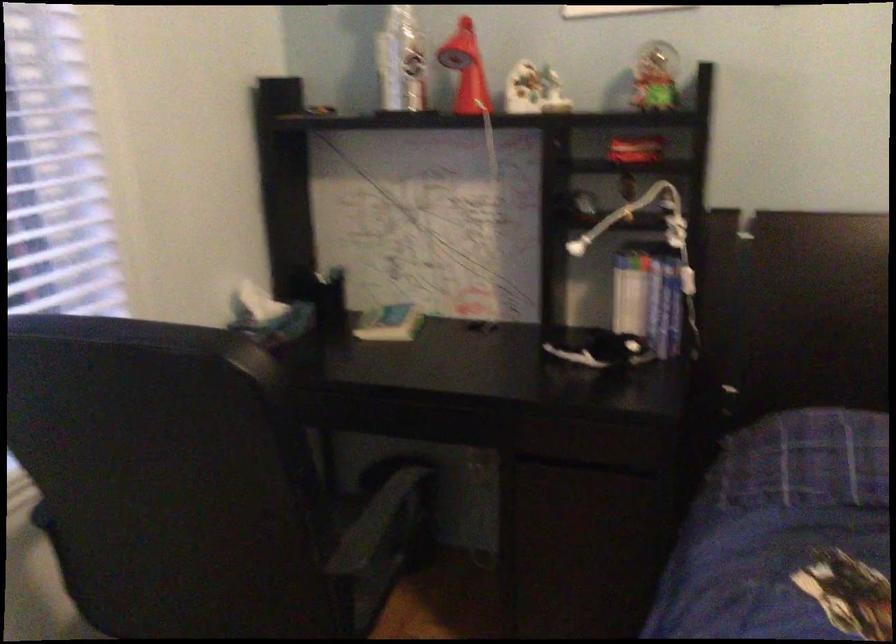
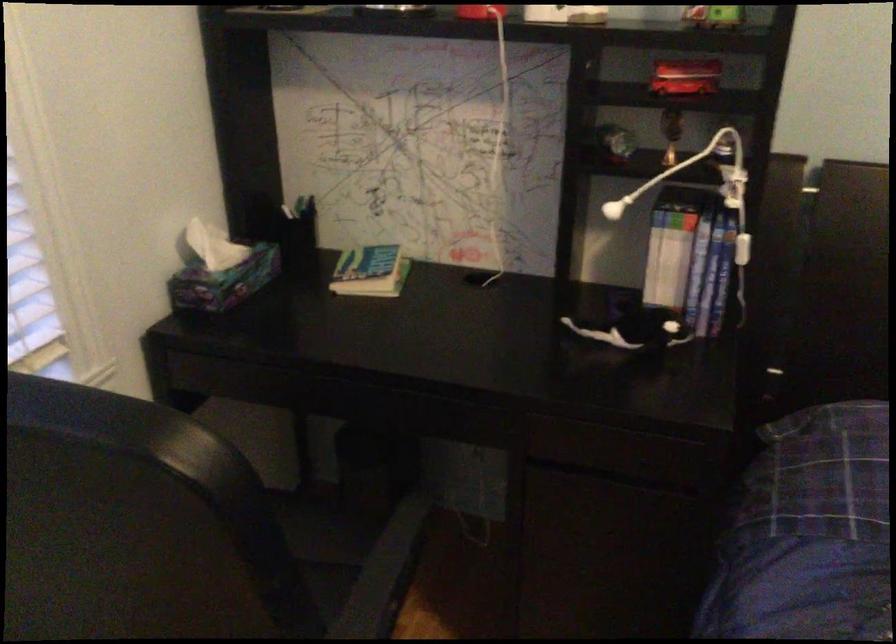
Where in the second image is the point corresponding to the point at 400,484 from the first image?

(399, 536)